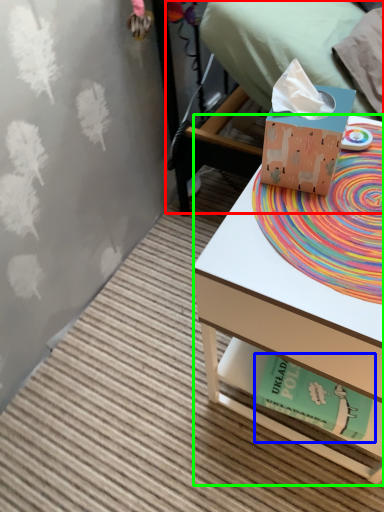
Question: Which is nearer to the bed (highlighted by a red box)? paperback book (highlighted by a blue box) or desk (highlighted by a green box).

Choices:
 (A) paperback book
 (B) desk

Answer: (B)